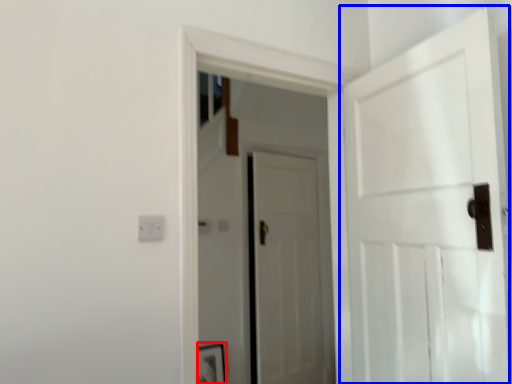
Question: Which object is closer to the camera taking this photo, picture frame (highlighted by a red box) or door (highlighted by a blue box)?

Choices:
 (A) picture frame
 (B) door

Answer: (B)